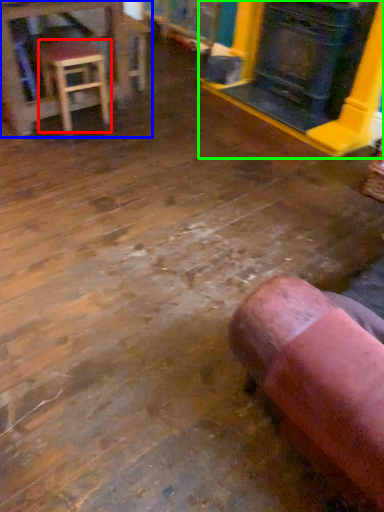
Question: Estimate the real-world distances between objects in this image. Which object is closer to stool (highlighted by a red box), table (highlighted by a blue box) or fireplace (highlighted by a green box)?

Choices:
 (A) table
 (B) fireplace

Answer: (A)